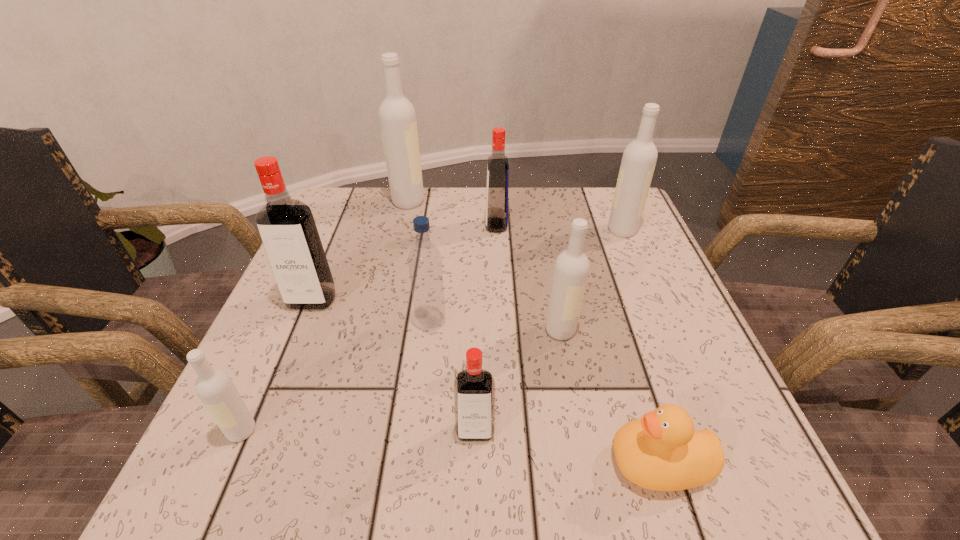
At what (x,y) coordinates should I click in order to perform the action: click on water bottle. Please return your answer as a coordinate pair (x, y). The height and width of the screenshot is (540, 960). Looking at the image, I should click on (425, 262).

This screenshot has width=960, height=540. I want to click on the leftmost white vodka, so click(x=214, y=387).

The image size is (960, 540). I want to click on the smallest white vodka, so click(x=214, y=387).

Locate an element on the screen. The width and height of the screenshot is (960, 540). the smallest red vodka is located at coordinates (474, 388).

The height and width of the screenshot is (540, 960). Find the location of `yellow duck`. yellow duck is located at coordinates (661, 451).

Where is `the shortest object`? the shortest object is located at coordinates (661, 451).

This screenshot has height=540, width=960. What are the coordinates of `vacant point located 0.360m on the right of the seventh object from right to left` in the screenshot? It's located at (563, 202).

Locate an element on the screen. The width and height of the screenshot is (960, 540). blank area located on the front of the rightmost vodka is located at coordinates (641, 275).

Locate an element on the screen. free region located on the front and back of the fourth nearest vodka is located at coordinates (280, 376).

Find the location of a particular element. blank space located on the front and back of the farthest red vodka is located at coordinates (461, 225).